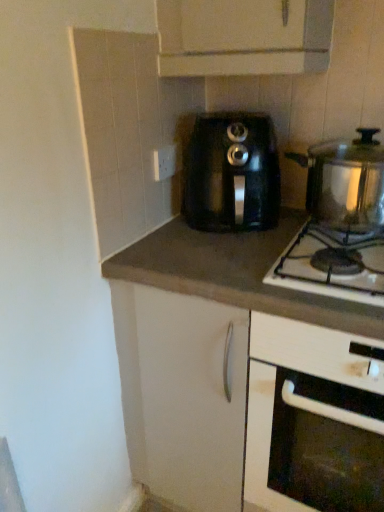
Describe the element at coordinates (231, 173) in the screenshot. I see `black plastic coffee maker at center, which is counted as the 1th kitchen appliance, starting from the left` at that location.

The width and height of the screenshot is (384, 512). Find the location of `black plastic coffee maker at center, placed as the second kitchen appliance when sorted from right to left`. black plastic coffee maker at center, placed as the second kitchen appliance when sorted from right to left is located at coordinates (231, 173).

Is white glossy oven at lower right closer to camera compared to black plastic coffee maker at center, which is counted as the 1th kitchen appliance, starting from the left?

Yes, white glossy oven at lower right is in front of black plastic coffee maker at center, which is counted as the 1th kitchen appliance, starting from the left.

From the image's perspective, does white glossy oven at lower right appear lower than black plastic coffee maker at center, placed as the second kitchen appliance when sorted from right to left?

Yes.

Is white glossy oven at lower right turned away from black plastic coffee maker at center, which is counted as the 1th kitchen appliance, starting from the left?

No, black plastic coffee maker at center, which is counted as the 1th kitchen appliance, starting from the left, is not at the back of white glossy oven at lower right.

The image size is (384, 512). I want to click on the 2nd kitchen appliance behind when counting from the white glossy oven at lower right, so click(x=231, y=173).

Where is `electric outlet on the left side of satin silver pot at right, the 2th kitchen appliance from the left`? electric outlet on the left side of satin silver pot at right, the 2th kitchen appliance from the left is located at coordinates (165, 162).

Is point (371, 193) positioned in front of point (159, 172)?

Yes.

Which is behind, satin silver pot at right, the 2th kitchen appliance from the left, or white plastic electric outlet at upper center?

white plastic electric outlet at upper center is behind.

Is satin silver pot at right, the first kitchen appliance viewed from the right, directly adjacent to white plastic electric outlet at upper center?

satin silver pot at right, the first kitchen appliance viewed from the right, and white plastic electric outlet at upper center are not in contact.

Does point (255, 145) appear closer or farther from the camera than point (354, 159)?

Point (255, 145) is positioned farther from the camera compared to point (354, 159).

Considering the relative sizes of black plastic coffee maker at center, placed as the second kitchen appliance when sorted from right to left, and satin silver pot at right, the first kitchen appliance viewed from the right, in the image provided, is black plastic coffee maker at center, placed as the second kitchen appliance when sorted from right to left, shorter than satin silver pot at right, the first kitchen appliance viewed from the right,?

No, black plastic coffee maker at center, placed as the second kitchen appliance when sorted from right to left, is not shorter than satin silver pot at right, the first kitchen appliance viewed from the right.

From the image's perspective, is black plastic coffee maker at center, placed as the second kitchen appliance when sorted from right to left, over satin silver pot at right, the first kitchen appliance viewed from the right?

Indeed, from the image's perspective, black plastic coffee maker at center, placed as the second kitchen appliance when sorted from right to left, is shown above satin silver pot at right, the first kitchen appliance viewed from the right.

In the scene shown: Between black plastic coffee maker at center, which is counted as the 1th kitchen appliance, starting from the left, and satin silver pot at right, the first kitchen appliance viewed from the right, which one appears on the right side from the viewer's perspective?

satin silver pot at right, the first kitchen appliance viewed from the right, is more to the right.

How distant is white glossy oven at lower right from stainless steel gas stove at right?

The distance of white glossy oven at lower right from stainless steel gas stove at right is 10.67 inches.

Can you tell me how much white glossy oven at lower right and stainless steel gas stove at right differ in facing direction?

white glossy oven at lower right and stainless steel gas stove at right are facing 0.323 degrees away from each other.

Which of these two, white glossy oven at lower right or stainless steel gas stove at right, stands shorter?

stainless steel gas stove at right.

Is white glossy oven at lower right to the right of stainless steel gas stove at right from the viewer's perspective?

Correct, you'll find white glossy oven at lower right to the right of stainless steel gas stove at right.

Based on their sizes in the image, would you say white plastic electric outlet at upper center is bigger or smaller than white glossy oven at lower right?

white plastic electric outlet at upper center is smaller than white glossy oven at lower right.

Does point (176, 146) come closer to viewer compared to point (277, 458)?

No.

Where is `electric outlet on the left side of white glossy oven at lower right`? electric outlet on the left side of white glossy oven at lower right is located at coordinates (165, 162).

Does white plastic electric outlet at upper center appear on the right side of white glossy oven at lower right?

No.

Between white plastic electric outlet at upper center and stainless steel gas stove at right, which one has smaller width?

Thinner between the two is white plastic electric outlet at upper center.

Measure the distance between white plastic electric outlet at upper center and stainless steel gas stove at right.

white plastic electric outlet at upper center and stainless steel gas stove at right are 20.51 inches apart.

From the image's perspective, is white plastic electric outlet at upper center positioned above or below stainless steel gas stove at right?

Clearly, from the image's perspective, white plastic electric outlet at upper center is above stainless steel gas stove at right.

In terms of size, does white plastic electric outlet at upper center appear bigger or smaller than stainless steel gas stove at right?

white plastic electric outlet at upper center is smaller than stainless steel gas stove at right.

Is the position of black plastic coffee maker at center, which is counted as the 1th kitchen appliance, starting from the left, more distant than that of white glossy oven at lower right?

Yes, it is behind white glossy oven at lower right.

Is black plastic coffee maker at center, placed as the second kitchen appliance when sorted from right to left, not close to white glossy oven at lower right?

No, black plastic coffee maker at center, placed as the second kitchen appliance when sorted from right to left, is not far from white glossy oven at lower right.

Considering the sizes of objects black plastic coffee maker at center, which is counted as the 1th kitchen appliance, starting from the left, and white glossy oven at lower right in the image provided, who is taller, black plastic coffee maker at center, which is counted as the 1th kitchen appliance, starting from the left, or white glossy oven at lower right?

white glossy oven at lower right.

Which of these two, black plastic coffee maker at center, placed as the second kitchen appliance when sorted from right to left, or white glossy oven at lower right, is wider?

white glossy oven at lower right is wider.

Find the location of `cabinetry below the black plastic coffee maker at center, which is counted as the 1th kitchen appliance, starting from the left (from a real-world perspective)`. cabinetry below the black plastic coffee maker at center, which is counted as the 1th kitchen appliance, starting from the left (from a real-world perspective) is located at coordinates (313, 419).

At what (x,y) coordinates should I click in order to perform the action: click on the 2nd kitchen appliance in front when counting from the white plastic electric outlet at upper center. Please return your answer as a coordinate pair (x, y). Looking at the image, I should click on (345, 182).

Based on their spatial positions, is white glossy oven at lower right or stainless steel gas stove at right further from satin silver pot at right, the 2th kitchen appliance from the left?

The object further to satin silver pot at right, the 2th kitchen appliance from the left, is white glossy oven at lower right.

Considering their positions, is black plastic coffee maker at center, which is counted as the 1th kitchen appliance, starting from the left, positioned further to matte gray countertop at center than white glossy oven at lower right?

white glossy oven at lower right.

From the image, which object appears to be nearer to white glossy oven at lower right, satin silver pot at right, the 2th kitchen appliance from the left, or stainless steel gas stove at right?

Based on the image, stainless steel gas stove at right appears to be nearer to white glossy oven at lower right.

Which object lies further to the anchor point stainless steel gas stove at right, matte gray countertop at center or black plastic coffee maker at center, which is counted as the 1th kitchen appliance, starting from the left?

black plastic coffee maker at center, which is counted as the 1th kitchen appliance, starting from the left, is positioned further to the anchor stainless steel gas stove at right.

From the image, which object appears to be farther from white plastic electric outlet at upper center, black plastic coffee maker at center, which is counted as the 1th kitchen appliance, starting from the left, or stainless steel gas stove at right?

Based on the image, stainless steel gas stove at right appears to be further to white plastic electric outlet at upper center.

Looking at the image, which one is located further to white glossy oven at lower right, satin silver pot at right, the 2th kitchen appliance from the left, or white plastic electric outlet at upper center?

white plastic electric outlet at upper center lies further to white glossy oven at lower right than the other object.

Based on the photo, which object lies nearer to the anchor point white plastic electric outlet at upper center, white glossy oven at lower right or matte gray countertop at center?

Among the two, matte gray countertop at center is located nearer to white plastic electric outlet at upper center.

Considering their positions, is matte gray countertop at center positioned further to stainless steel gas stove at right than white plastic electric outlet at upper center?

white plastic electric outlet at upper center lies further to stainless steel gas stove at right than the other object.

Where is `gas stove between satin silver pot at right, the first kitchen appliance viewed from the right, and matte gray countertop at center, in the vertical direction`? The width and height of the screenshot is (384, 512). gas stove between satin silver pot at right, the first kitchen appliance viewed from the right, and matte gray countertop at center, in the vertical direction is located at coordinates (332, 265).

At what (x,y) coordinates should I click in order to perform the action: click on countertop between black plastic coffee maker at center, placed as the second kitchen appliance when sorted from right to left, and white glossy oven at lower right, in the vertical direction. Please return your answer as a coordinate pair (x, y). The image size is (384, 512). Looking at the image, I should click on (234, 273).

Find the location of a particular element. kitchen appliance between white plastic electric outlet at upper center and satin silver pot at right, the first kitchen appliance viewed from the right, in the horizontal direction is located at coordinates (231, 173).

Locate an element on the screen. This screenshot has width=384, height=512. countertop between stainless steel gas stove at right and white glossy oven at lower right in the vertical direction is located at coordinates (234, 273).